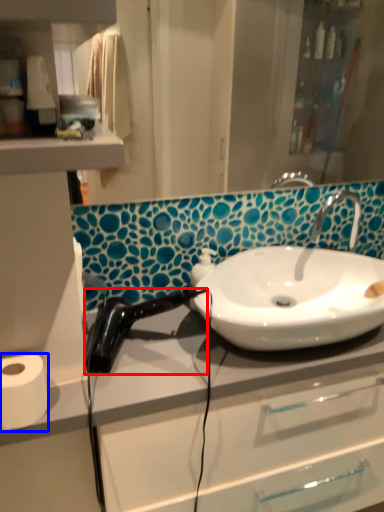
Question: Which object appears closest to the camera in this image, hair drier (highlighted by a red box) or toilet paper (highlighted by a blue box)?

Choices:
 (A) hair drier
 (B) toilet paper

Answer: (B)